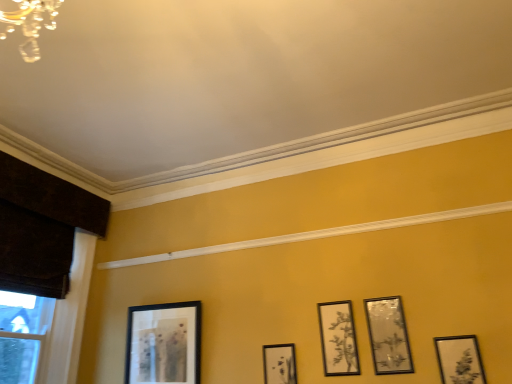
Where is `black matte picture frame at lower left, marked as the 5th picture frame in a right-to-left arrangement`? The width and height of the screenshot is (512, 384). black matte picture frame at lower left, marked as the 5th picture frame in a right-to-left arrangement is located at coordinates (163, 343).

Where is `matte silver picture frame at upper right, positioned as the 2th picture frame in right-to-left order`? matte silver picture frame at upper right, positioned as the 2th picture frame in right-to-left order is located at coordinates pos(388,336).

Is black matte picture frame at lower left, the first picture frame in the left-to-right sequence, inside or outside of dark brown wood at left?

black matte picture frame at lower left, the first picture frame in the left-to-right sequence, exists outside the volume of dark brown wood at left.

Does black matte picture frame at lower left, the first picture frame in the left-to-right sequence, turn towards dark brown wood at left?

Result: No.

How different are the orientations of black matte picture frame at lower left, the first picture frame in the left-to-right sequence, and dark brown wood at left in degrees?

The angular difference between black matte picture frame at lower left, the first picture frame in the left-to-right sequence, and dark brown wood at left is 91.5 degrees.

Which object is further away from the camera, black matte picture frame at lower left, marked as the 5th picture frame in a right-to-left arrangement, or dark brown wood at left?

black matte picture frame at lower left, marked as the 5th picture frame in a right-to-left arrangement, is more distant.

In the image, is matte silver picture frame at upper right, positioned as the 2th picture frame in right-to-left order, on the left side or the right side of matte black picture frame at center, acting as the 3th picture frame starting from the right?

In the image, matte silver picture frame at upper right, positioned as the 2th picture frame in right-to-left order, appears on the right side of matte black picture frame at center, acting as the 3th picture frame starting from the right.

Looking at this image, from a real-world perspective, does matte silver picture frame at upper right, positioned as the 2th picture frame in right-to-left order, stand above matte black picture frame at center, acting as the 3th picture frame starting from the right?

Indeed, from a real-world perspective, matte silver picture frame at upper right, positioned as the 2th picture frame in right-to-left order, stands above matte black picture frame at center, acting as the 3th picture frame starting from the right.

Considering the relative sizes of matte silver picture frame at upper right, the 4th picture frame viewed from the left, and matte black picture frame at center, which is counted as the 3th picture frame, starting from the left, in the image provided, is matte silver picture frame at upper right, the 4th picture frame viewed from the left, thinner than matte black picture frame at center, which is counted as the 3th picture frame, starting from the left,?

Incorrect, the width of matte silver picture frame at upper right, the 4th picture frame viewed from the left, is not less than that of matte black picture frame at center, which is counted as the 3th picture frame, starting from the left.

Which object is more forward, matte silver picture frame at upper right, positioned as the 2th picture frame in right-to-left order, or matte black picture frame at center, acting as the 3th picture frame starting from the right?

Positioned in front is matte silver picture frame at upper right, positioned as the 2th picture frame in right-to-left order.

Considering the relative sizes of dark brown wood at left and black matte picture frame at lower left, the first picture frame in the left-to-right sequence, in the image provided, is dark brown wood at left thinner than black matte picture frame at lower left, the first picture frame in the left-to-right sequence,?

In fact, dark brown wood at left might be wider than black matte picture frame at lower left, the first picture frame in the left-to-right sequence.

Which is nearer, (75, 263) or (159, 323)?

The point (159, 323) is closer.

Is black matte picture frame at lower left, marked as the 5th picture frame in a right-to-left arrangement, inside dark brown wood at left?

Definitely not — black matte picture frame at lower left, marked as the 5th picture frame in a right-to-left arrangement, is not inside dark brown wood at left.

From a real-world perspective, is black matte picture frame at lower left, the first picture frame in the left-to-right sequence, physically located above or below matte black picture frame at center, acting as the 3th picture frame starting from the right?

Clearly, from a real-world perspective, black matte picture frame at lower left, the first picture frame in the left-to-right sequence, is above matte black picture frame at center, acting as the 3th picture frame starting from the right.

Does black matte picture frame at lower left, the first picture frame in the left-to-right sequence, have a smaller size compared to matte black picture frame at center, acting as the 3th picture frame starting from the right?

No, black matte picture frame at lower left, the first picture frame in the left-to-right sequence, is not smaller than matte black picture frame at center, acting as the 3th picture frame starting from the right.

Is black matte picture frame at lower left, the first picture frame in the left-to-right sequence, touching matte black picture frame at center, which is counted as the 3th picture frame, starting from the left?

No, black matte picture frame at lower left, the first picture frame in the left-to-right sequence, is not in contact with matte black picture frame at center, which is counted as the 3th picture frame, starting from the left.

Between black matte picture frame at lower left, marked as the 5th picture frame in a right-to-left arrangement, and matte black picture frame at center, acting as the 3th picture frame starting from the right, which one appears on the right side from the viewer's perspective?

From the viewer's perspective, matte black picture frame at center, acting as the 3th picture frame starting from the right, appears more on the right side.

Is matte black picture frame at lower right, which is counted as the fifth picture frame, starting from the left, a part of matte black picture frame at center, which appears as the second picture frame when viewed from the left?

No.

How many degrees apart are the facing directions of matte black picture frame at center, marked as the fourth picture frame in a right-to-left arrangement, and matte black picture frame at lower right, acting as the 1th picture frame starting from the right?

0.00144 degrees separate the facing orientations of matte black picture frame at center, marked as the fourth picture frame in a right-to-left arrangement, and matte black picture frame at lower right, acting as the 1th picture frame starting from the right.

Is matte black picture frame at center, marked as the fourth picture frame in a right-to-left arrangement, taller or shorter than matte black picture frame at lower right, acting as the 1th picture frame starting from the right?

matte black picture frame at center, marked as the fourth picture frame in a right-to-left arrangement, is taller than matte black picture frame at lower right, acting as the 1th picture frame starting from the right.

Could you tell me if matte black picture frame at center, marked as the fourth picture frame in a right-to-left arrangement, is turned towards matte black picture frame at lower right, which is counted as the fifth picture frame, starting from the left?

No, matte black picture frame at center, marked as the fourth picture frame in a right-to-left arrangement, is not turned towards matte black picture frame at lower right, which is counted as the fifth picture frame, starting from the left.

Which object is further away from the camera, black matte picture frame at lower left, the first picture frame in the left-to-right sequence, or matte black picture frame at center, which appears as the second picture frame when viewed from the left?

black matte picture frame at lower left, the first picture frame in the left-to-right sequence, is more distant.

In the scene shown: Which of these two, black matte picture frame at lower left, marked as the 5th picture frame in a right-to-left arrangement, or matte black picture frame at center, marked as the fourth picture frame in a right-to-left arrangement, stands shorter?

matte black picture frame at center, marked as the fourth picture frame in a right-to-left arrangement, is shorter.

Which is closer to the camera, (173,371) or (288,376)?

Point (288,376)

From the image's perspective, relative to black matte picture frame at lower left, the first picture frame in the left-to-right sequence, is matte silver picture frame at upper right, the 4th picture frame viewed from the left, above or below?

From the image's perspective, matte silver picture frame at upper right, the 4th picture frame viewed from the left, appears above black matte picture frame at lower left, the first picture frame in the left-to-right sequence.

From a real-world perspective, is matte silver picture frame at upper right, positioned as the 2th picture frame in right-to-left order, physically located above or below black matte picture frame at lower left, the first picture frame in the left-to-right sequence?

In terms of real-world spatial position, matte silver picture frame at upper right, positioned as the 2th picture frame in right-to-left order, is below black matte picture frame at lower left, the first picture frame in the left-to-right sequence.

Which object is thinner, matte silver picture frame at upper right, the 4th picture frame viewed from the left, or black matte picture frame at lower left, marked as the 5th picture frame in a right-to-left arrangement?

With smaller width is matte silver picture frame at upper right, the 4th picture frame viewed from the left.

At what (x,y) coordinates should I click in order to perform the action: click on window frame on the left of black matte picture frame at lower left, the first picture frame in the left-to-right sequence. Please return your answer as a coordinate pair (x, y). This screenshot has width=512, height=384. Looking at the image, I should click on (68, 319).

Where is `the 1st picture frame behind the matte silver picture frame at upper right, the 4th picture frame viewed from the left, starting your count from the anchor`? The image size is (512, 384). the 1st picture frame behind the matte silver picture frame at upper right, the 4th picture frame viewed from the left, starting your count from the anchor is located at coordinates (338, 339).

Which object lies further to the anchor point matte silver picture frame at upper right, positioned as the 2th picture frame in right-to-left order, matte black picture frame at lower right, acting as the 1th picture frame starting from the right, or dark brown wood at left?

dark brown wood at left.

Which object lies further to the anchor point matte black picture frame at center, marked as the fourth picture frame in a right-to-left arrangement, black matte picture frame at lower left, marked as the 5th picture frame in a right-to-left arrangement, or matte silver picture frame at upper right, positioned as the 2th picture frame in right-to-left order?

black matte picture frame at lower left, marked as the 5th picture frame in a right-to-left arrangement, is further to matte black picture frame at center, marked as the fourth picture frame in a right-to-left arrangement.

Considering their positions, is matte black picture frame at lower right, which is counted as the fifth picture frame, starting from the left, positioned further to matte black picture frame at center, marked as the fourth picture frame in a right-to-left arrangement, than matte black picture frame at center, which is counted as the 3th picture frame, starting from the left?

matte black picture frame at lower right, which is counted as the fifth picture frame, starting from the left, lies further to matte black picture frame at center, marked as the fourth picture frame in a right-to-left arrangement, than the other object.

Which object lies further to the anchor point matte black picture frame at center, which appears as the second picture frame when viewed from the left, matte black picture frame at lower right, which is counted as the fifth picture frame, starting from the left, or matte silver picture frame at upper right, positioned as the 2th picture frame in right-to-left order?

matte black picture frame at lower right, which is counted as the fifth picture frame, starting from the left.

When comparing their distances from black matte picture frame at lower left, marked as the 5th picture frame in a right-to-left arrangement, does matte silver picture frame at upper right, positioned as the 2th picture frame in right-to-left order, or dark brown wood at left seem closer?

dark brown wood at left lies closer to black matte picture frame at lower left, marked as the 5th picture frame in a right-to-left arrangement, than the other object.

Looking at the image, which one is located closer to black matte picture frame at lower left, marked as the 5th picture frame in a right-to-left arrangement, matte black picture frame at center, acting as the 3th picture frame starting from the right, or matte black picture frame at center, which appears as the second picture frame when viewed from the left?

matte black picture frame at center, which appears as the second picture frame when viewed from the left, is positioned closer to the anchor black matte picture frame at lower left, marked as the 5th picture frame in a right-to-left arrangement.

Based on their spatial positions, is matte black picture frame at center, which appears as the second picture frame when viewed from the left, or black matte picture frame at lower left, marked as the 5th picture frame in a right-to-left arrangement, closer to matte black picture frame at lower right, which is counted as the fifth picture frame, starting from the left?

matte black picture frame at center, which appears as the second picture frame when viewed from the left, is closer to matte black picture frame at lower right, which is counted as the fifth picture frame, starting from the left.

Which object lies further to the anchor point black matte picture frame at lower left, marked as the 5th picture frame in a right-to-left arrangement, dark brown wood at left or matte black picture frame at center, acting as the 3th picture frame starting from the right?

Based on the image, matte black picture frame at center, acting as the 3th picture frame starting from the right, appears to be further to black matte picture frame at lower left, marked as the 5th picture frame in a right-to-left arrangement.

You are a GUI agent. You are given a task and a screenshot of the screen. Output one action in this format:
    pyautogui.click(x=<x>, y=<y>)
    Task: Click on the picture frame between matte black picture frame at center, which appears as the second picture frame when viewed from the left, and matte silver picture frame at upper right, the 4th picture frame viewed from the left, in the horizontal direction
    
    Given the screenshot: What is the action you would take?
    point(338,339)

Image resolution: width=512 pixels, height=384 pixels. Find the location of `picture frame between matte black picture frame at center, acting as the 3th picture frame starting from the right, and matte black picture frame at lower right, which is counted as the fifth picture frame, starting from the left, from left to right`. picture frame between matte black picture frame at center, acting as the 3th picture frame starting from the right, and matte black picture frame at lower right, which is counted as the fifth picture frame, starting from the left, from left to right is located at coordinates coord(388,336).

Locate an element on the screen. picture frame between black matte picture frame at lower left, marked as the 5th picture frame in a right-to-left arrangement, and matte black picture frame at center, acting as the 3th picture frame starting from the right, from left to right is located at coordinates (279, 364).

You are a GUI agent. You are given a task and a screenshot of the screen. Output one action in this format:
    pyautogui.click(x=<x>, y=<y>)
    Task: Click on the picture frame between dark brown wood at left and matte black picture frame at center, which appears as the second picture frame when viewed from the left
    The image size is (512, 384).
    Given the screenshot: What is the action you would take?
    pyautogui.click(x=163, y=343)